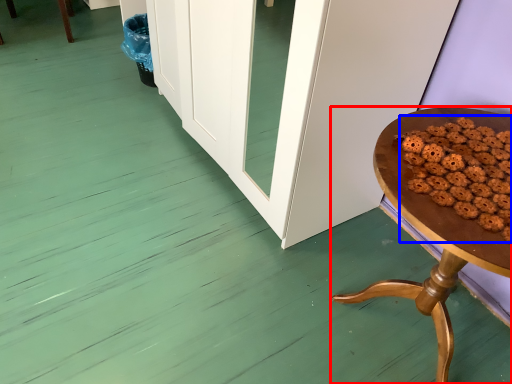
Question: Which of the following is the farthest to the observer, table (highlighted by a red box) or food (highlighted by a blue box)?

Choices:
 (A) table
 (B) food

Answer: (B)